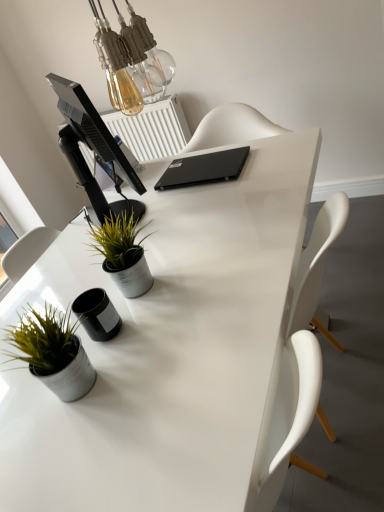
Question: Should I look upward or downward to see white glossy desk at center?

Choices:
 (A) down
 (B) up

Answer: (A)

Question: Is the depth of white glossy desk at center less than that of white plastic radiator at upper center?

Choices:
 (A) no
 (B) yes

Answer: (B)

Question: Is the surface of white glossy desk at center in direct contact with white plastic radiator at upper center?

Choices:
 (A) yes
 (B) no

Answer: (B)

Question: Is white glossy desk at center looking in the opposite direction of white plastic radiator at upper center?

Choices:
 (A) no
 (B) yes

Answer: (A)

Question: Does white glossy desk at center have a greater height compared to white plastic radiator at upper center?

Choices:
 (A) yes
 (B) no

Answer: (A)

Question: Is white glossy desk at center to the right of white plastic radiator at upper center from the viewer's perspective?

Choices:
 (A) yes
 (B) no

Answer: (A)

Question: Considering the relative sizes of white glossy desk at center and white plastic radiator at upper center in the image provided, is white glossy desk at center thinner than white plastic radiator at upper center?

Choices:
 (A) yes
 (B) no

Answer: (B)

Question: Does matte gray pot at lower left, marked as the 2th houseplant in a back-to-front arrangement, have a lesser width compared to metallic gray pot at center, the second houseplant positioned from the front?

Choices:
 (A) no
 (B) yes

Answer: (B)

Question: Considering the relative positions of matte gray pot at lower left, marked as the first houseplant in a front-to-back arrangement, and metallic gray pot at center, marked as the 1th houseplant in a back-to-front arrangement, in the image provided, is matte gray pot at lower left, marked as the first houseplant in a front-to-back arrangement, in front of metallic gray pot at center, marked as the 1th houseplant in a back-to-front arrangement,?

Choices:
 (A) yes
 (B) no

Answer: (A)

Question: Is metallic gray pot at center, placed as the 1th houseplant when sorted from top to bottom, located within matte gray pot at lower left, which is counted as the first houseplant, starting from the bottom?

Choices:
 (A) yes
 (B) no

Answer: (B)

Question: Considering the relative positions of matte gray pot at lower left, which is counted as the first houseplant, starting from the bottom, and metallic gray pot at center, the second houseplant positioned from the front, in the image provided, is matte gray pot at lower left, which is counted as the first houseplant, starting from the bottom, to the left of metallic gray pot at center, the second houseplant positioned from the front, from the viewer's perspective?

Choices:
 (A) no
 (B) yes

Answer: (B)

Question: Is matte gray pot at lower left, which is counted as the first houseplant, starting from the bottom, positioned beyond the bounds of metallic gray pot at center, the second houseplant positioned from the front?

Choices:
 (A) no
 (B) yes

Answer: (B)

Question: Does matte gray pot at lower left, marked as the first houseplant in a front-to-back arrangement, lie behind metallic gray pot at center, marked as the 1th houseplant in a back-to-front arrangement?

Choices:
 (A) yes
 (B) no

Answer: (B)

Question: Considering the relative sizes of black matte laptop at center and matte gray pot at lower left, which is the 2th houseplant from top to bottom, in the image provided, is black matte laptop at center smaller than matte gray pot at lower left, which is the 2th houseplant from top to bottom,?

Choices:
 (A) yes
 (B) no

Answer: (A)